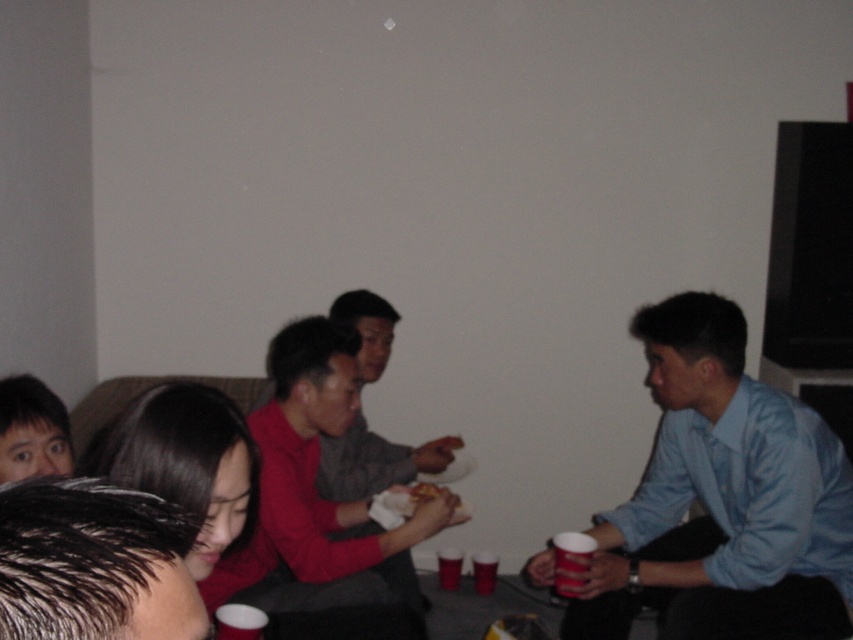
Question: Based on their relative distances, which object is nearer to the red matte shirt at center?

Choices:
 (A) golden crispy chicken at center
 (B) slick black hair at lower left

Answer: (A)

Question: Is slick black hair at lower left to the left of golden crispy chicken at center from the viewer's perspective?

Choices:
 (A) no
 (B) yes

Answer: (B)

Question: Which object is closer to the camera taking this photo?

Choices:
 (A) golden crispy chicken at center
 (B) slick black hair at lower left

Answer: (B)

Question: Does red matte shirt at center appear under golden crispy chicken at center?

Choices:
 (A) no
 (B) yes

Answer: (B)

Question: Considering the relative positions of light blue shirt at right and golden crispy chicken at center in the image provided, where is light blue shirt at right located with respect to golden crispy chicken at center?

Choices:
 (A) above
 (B) below

Answer: (A)

Question: Which point is farther to the camera?

Choices:
 (A) (424, 497)
 (B) (15, 451)
 (C) (254, 417)
 (D) (577, 580)

Answer: (A)